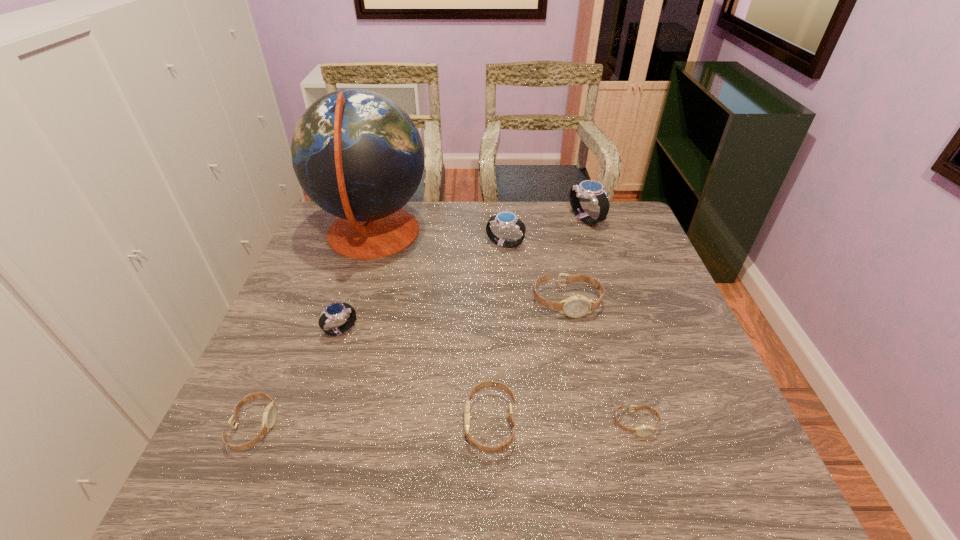
At what (x,y) coordinates should I click in order to perform the action: click on beige watch that is the closest to the smallest beige watch. Please return your answer as a coordinate pair (x, y). The height and width of the screenshot is (540, 960). Looking at the image, I should click on (506, 444).

Find the location of a particular element. The height and width of the screenshot is (540, 960). free spot that satisfies the following two spatial constraints: 1. on the face of the biggest beige watch; 2. on the face of the sixth tallest watch is located at coordinates (593, 427).

This screenshot has width=960, height=540. What are the coordinates of `vacant space that satisfies the following two spatial constraints: 1. on the front side of the rightmost silver watch; 2. on the face of the leftmost beige watch` in the screenshot? It's located at (653, 427).

Image resolution: width=960 pixels, height=540 pixels. Find the location of `vacant space that satisfies the following two spatial constraints: 1. with the Americas facing the viewer on the second silver watch from right to left; 2. on the right side of the globe`. vacant space that satisfies the following two spatial constraints: 1. with the Americas facing the viewer on the second silver watch from right to left; 2. on the right side of the globe is located at coordinates (370, 245).